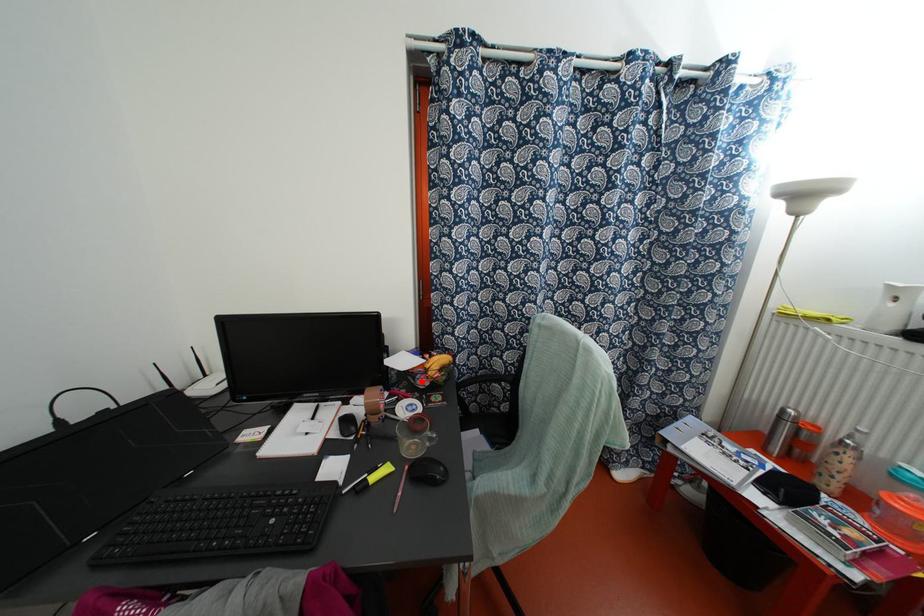
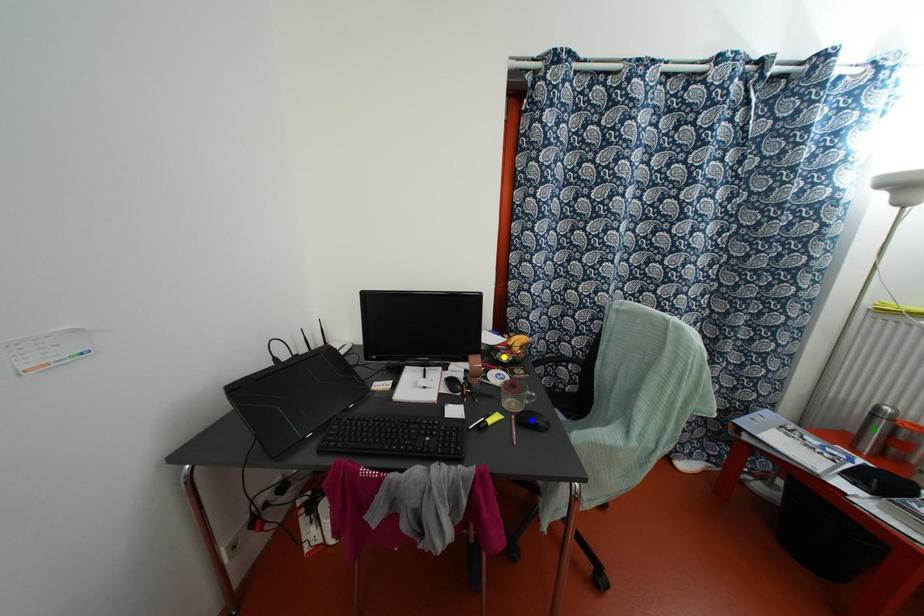
Question: I am providing you with two images of the same scene from different viewpoints. A red point is marked on the first image. You are given multiple points on the second image. In image 2, which mark is for the same physical point as the one in image 1?

Choices:
 (A) blue point
 (B) green point
 (C) yellow point

Answer: (C)